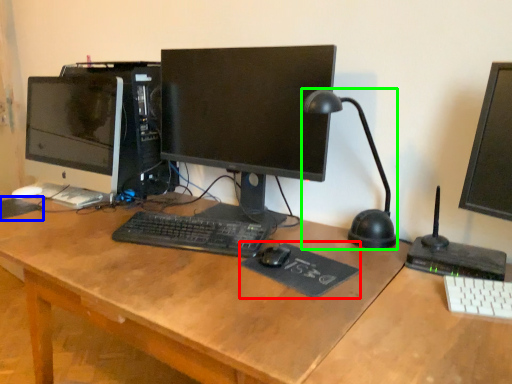
Question: Which is farther away from mousepad (highlighted by a red box)? mousepad (highlighted by a blue box) or table lamp (highlighted by a green box)?

Choices:
 (A) mousepad
 (B) table lamp

Answer: (A)